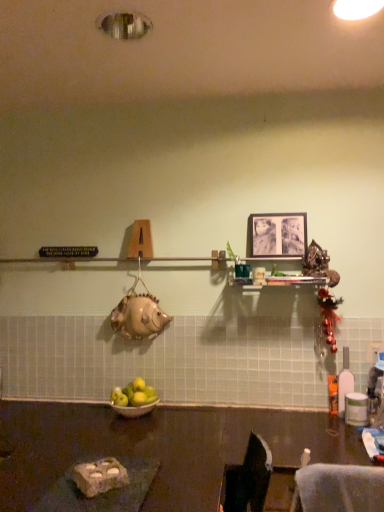
I want to click on vacant space situated on the left part of translucent plastic bottle at right, so click(317, 413).